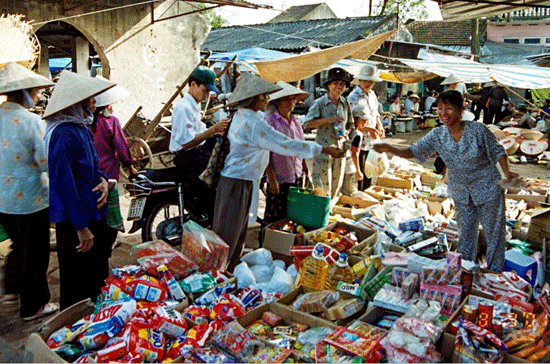
The height and width of the screenshot is (364, 550). In order to click on cardboard boxes in this screenshot , I will do `click(296, 311)`, `click(69, 316)`, `click(531, 231)`.